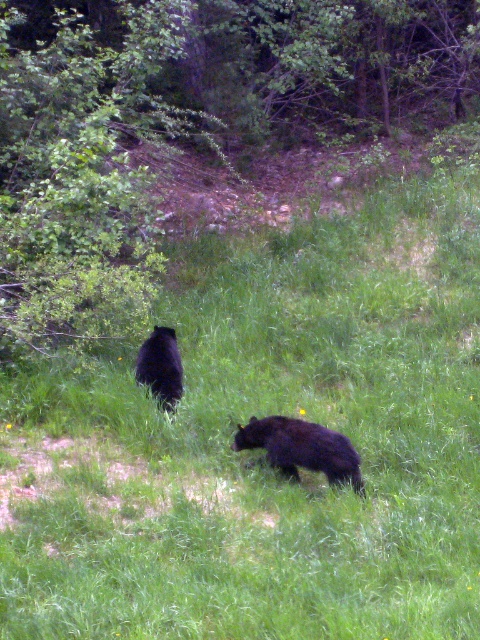
Question: Can you confirm if green leafy tree at upper left is thinner than black furry bear at lower center?

Choices:
 (A) yes
 (B) no

Answer: (B)

Question: Which point is closer to the camera?

Choices:
 (A) black fuzzy bear at center
 (B) green leafy tree at upper left
 (C) black furry bear at lower center

Answer: (C)

Question: Is black furry bear at lower center to the left of black fuzzy bear at center from the viewer's perspective?

Choices:
 (A) yes
 (B) no

Answer: (B)

Question: Among these objects, which one is farthest from the camera?

Choices:
 (A) black fuzzy bear at center
 (B) black furry bear at lower center
 (C) green leafy tree at upper left

Answer: (A)

Question: Which point is closer to the camera?

Choices:
 (A) green leafy tree at upper left
 (B) black fuzzy bear at center
 (C) black furry bear at lower center

Answer: (C)

Question: From the image, what is the correct spatial relationship of green leafy tree at upper left in relation to black fuzzy bear at center?

Choices:
 (A) right
 (B) left

Answer: (B)